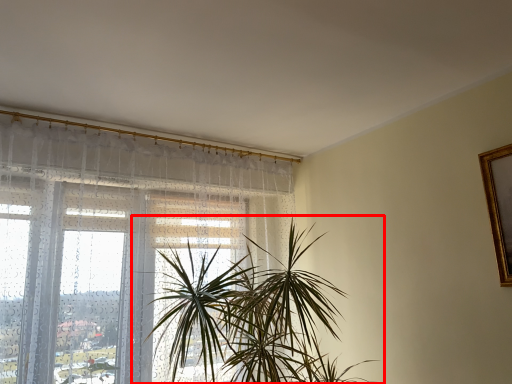
Question: From the image's perspective, where is houseplant (annotated by the red box) located relative to window?

Choices:
 (A) below
 (B) above

Answer: (A)